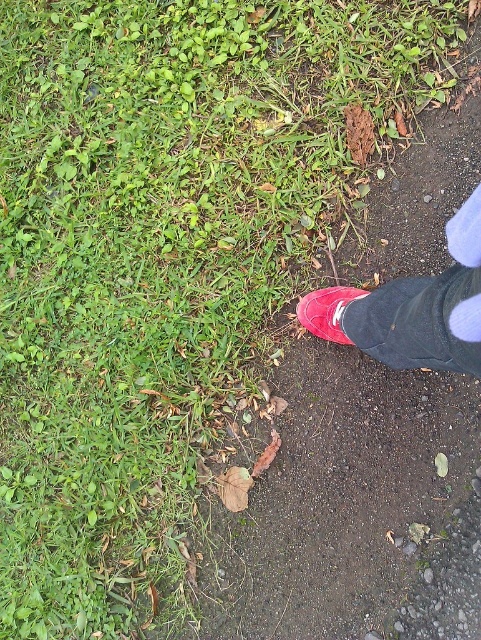
Question: Which of the following is the farthest from the observer?

Choices:
 (A) (301, 314)
 (B) (427, 340)

Answer: (A)

Question: In this image, where is rubber shoe at lower right located relative to matte red shoe at lower right?

Choices:
 (A) left
 (B) right

Answer: (B)

Question: Which point appears closest to the camera in this image?

Choices:
 (A) (331, 328)
 (B) (387, 337)

Answer: (B)

Question: Is rubber shoe at lower right further to the viewer compared to matte red shoe at lower right?

Choices:
 (A) yes
 (B) no

Answer: (B)

Question: Is rubber shoe at lower right wider than matte red shoe at lower right?

Choices:
 (A) yes
 (B) no

Answer: (A)